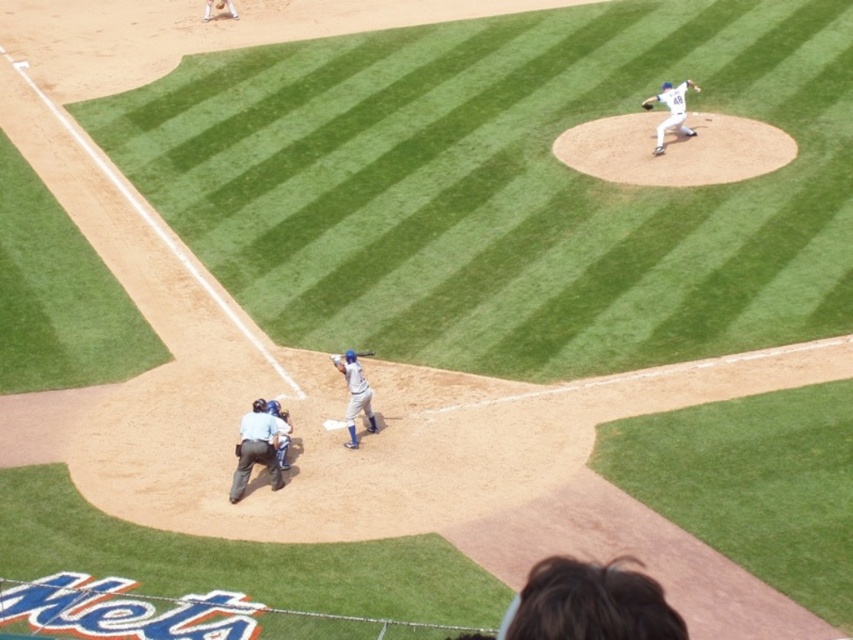
Can you confirm if blue uniform bat at center is wider than white matte baseball pitcher at upper right?

Incorrect, blue uniform bat at center's width does not surpass white matte baseball pitcher at upper right's.

Does blue uniform bat at center have a smaller size compared to white matte baseball pitcher at upper right?

Yes.

You are a GUI agent. You are given a task and a screenshot of the screen. Output one action in this format:
    pyautogui.click(x=<x>, y=<y>)
    Task: Click on the blue uniform bat at center
    Image resolution: width=853 pixels, height=640 pixels.
    Given the screenshot: What is the action you would take?
    pyautogui.click(x=354, y=394)

Is blue fabric catcher at lower center closer to camera compared to matte blue bat at center?

Yes, it is.

Who is shorter, blue fabric catcher at lower center or matte blue bat at center?

Standing shorter between the two is matte blue bat at center.

Find the location of a particular element. Image resolution: width=853 pixels, height=640 pixels. blue fabric catcher at lower center is located at coordinates (280, 432).

Which is more to the left, light blue uniform at center or matte blue bat at center?

light blue uniform at center

Is light blue uniform at center taller than matte blue bat at center?

Yes, light blue uniform at center is taller than matte blue bat at center.

Describe the element at coordinates (254, 449) in the screenshot. This screenshot has height=640, width=853. I see `light blue uniform at center` at that location.

At what (x,y) coordinates should I click in order to perform the action: click on light blue uniform at center. Please return your answer as a coordinate pair (x, y). The image size is (853, 640). Looking at the image, I should click on (254, 449).